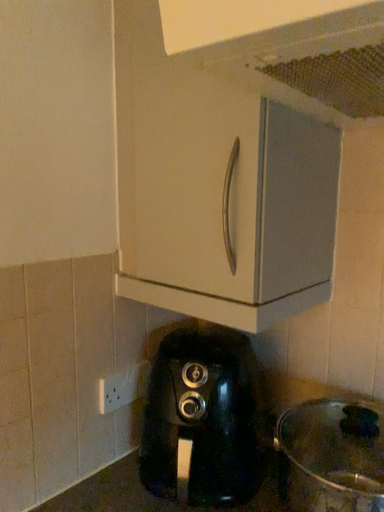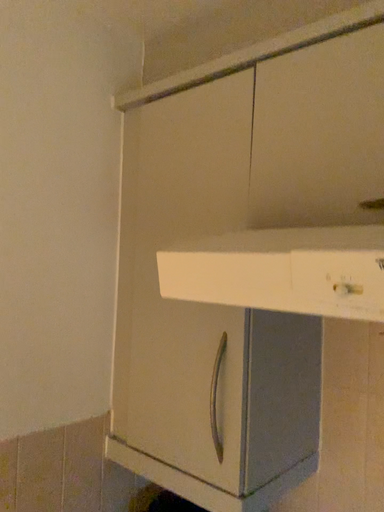
Question: How did the camera likely rotate when shooting the video?

Choices:
 (A) rotated downward
 (B) rotated upward

Answer: (B)